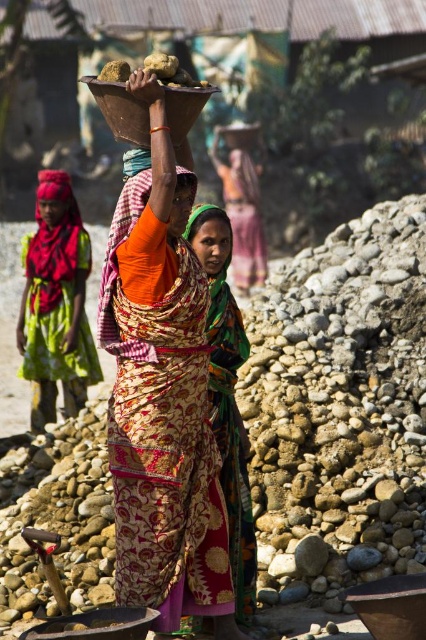
Question: Which of the following is the farthest from the observer?

Choices:
 (A) pink fabric headscarf at upper left
 (B) matte orange headscarf at center
 (C) green fabric dress at left

Answer: (A)

Question: Which point is farther to the camera?

Choices:
 (A) matte orange headscarf at center
 (B) multicolored fabric headscarf at center

Answer: (B)

Question: Is orange fabric sari at center positioned behind matte orange headscarf at center?

Choices:
 (A) yes
 (B) no

Answer: (A)

Question: Can you confirm if orange fabric sari at center is positioned to the right of multicolored fabric headscarf at center?

Choices:
 (A) no
 (B) yes

Answer: (B)

Question: In this image, where is printed fabric sari at center located relative to orange fabric sari at center?

Choices:
 (A) right
 (B) left

Answer: (B)

Question: Which point appears closest to the camera in this image?

Choices:
 (A) (258, 176)
 (B) (66, 179)

Answer: (B)